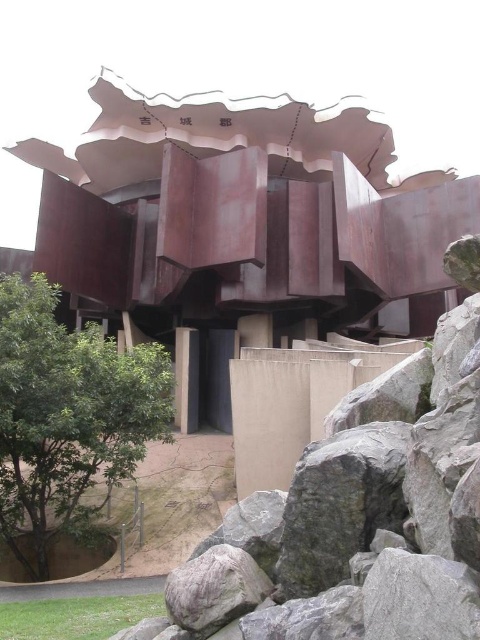
You are a landscape architect designing a new garden path between the rusty metal structure at center and the green leafy tree at lower left. The path must be at least 35 feet long to accommodate a walking area. Can the path be constructed between these two objects without being too short?

The rusty metal structure at center and the green leafy tree at lower left are 37.54 feet apart from each other. Since 37.54 feet is longer than the required 35 feet, the path can be constructed between them and meet the length requirement.

Consider the image. You are standing at the entrance of the modern architectural structure and want to take a photo of both the rusty metal structure at center and the green leafy tree at lower left. Which object should you position to your left side to include both in the frame?

To include both the rusty metal structure at center and the green leafy tree at lower left in the frame, position the green leafy tree at lower left to your left side since it is already located to the left of the rusty metal structure at center.

You are standing at the center of the modern architectural structure described in the scene. There is a rusty metal structure located at point (239, 214). If you were to walk directly towards the rusty metal structure at center, which direction should you head?

Since the rusty metal structure at center is already at the center point (239, 214), you are already facing it. There is no need to change direction.